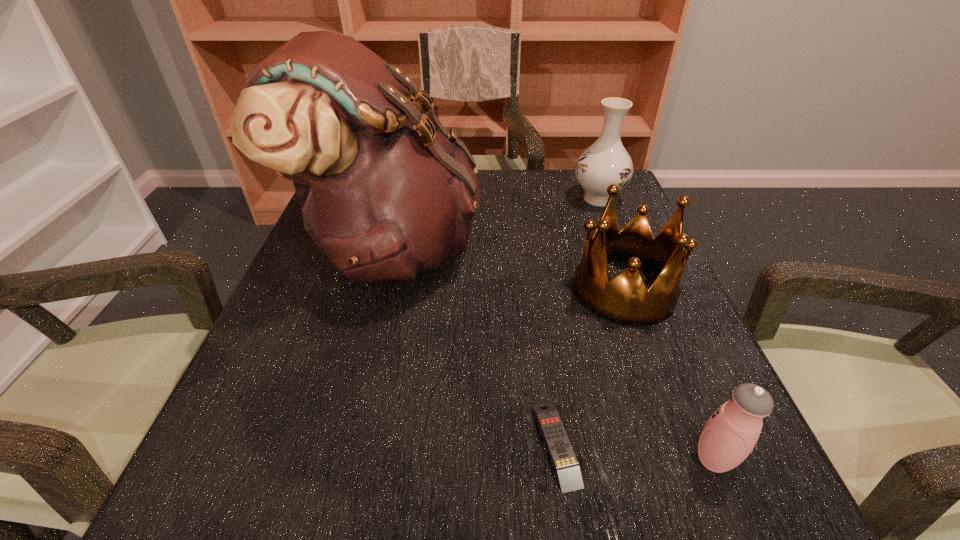
Locate an element on the screen. The width and height of the screenshot is (960, 540). the tallest object is located at coordinates (386, 193).

Find the location of a particular element. the leftmost object is located at coordinates (386, 193).

This screenshot has width=960, height=540. I want to click on the fourth shortest object, so click(x=606, y=161).

You are a GUI agent. You are given a task and a screenshot of the screen. Output one action in this format:
    pyautogui.click(x=<x>, y=<y>)
    Task: Click on the crown
    Image resolution: width=960 pixels, height=540 pixels.
    Given the screenshot: What is the action you would take?
    pyautogui.click(x=624, y=300)

Find the location of `the second shortest object`. the second shortest object is located at coordinates (730, 434).

The image size is (960, 540). Find the location of `the fourth object from right to left`. the fourth object from right to left is located at coordinates (565, 463).

Identify the location of the shortest object. (565, 463).

You are a GUI agent. You are given a task and a screenshot of the screen. Output one action in this format:
    pyautogui.click(x=<x>, y=<y>)
    Task: Click on the free location located 0.230m at the front of the leftmost object with buckles
    The width and height of the screenshot is (960, 540).
    Given the screenshot: What is the action you would take?
    pyautogui.click(x=584, y=249)

Locate an element on the screen. vacant area located on the front of the vase is located at coordinates (639, 305).

You are a GUI agent. You are given a task and a screenshot of the screen. Output one action in this format:
    pyautogui.click(x=<x>, y=<y>)
    Task: Click on the vacant region located 0.320m on the front of the crown
    
    Given the screenshot: What is the action you would take?
    pyautogui.click(x=705, y=512)